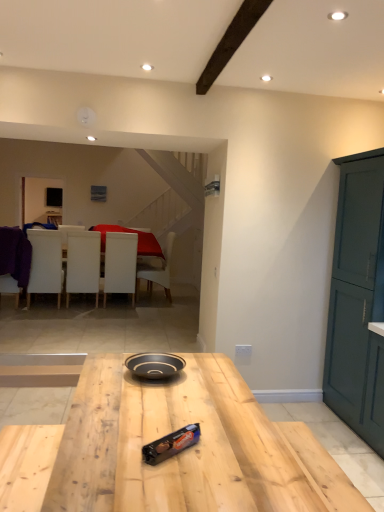
Find the location of a particular element. space that is in front of matte black bowl at center is located at coordinates (155, 398).